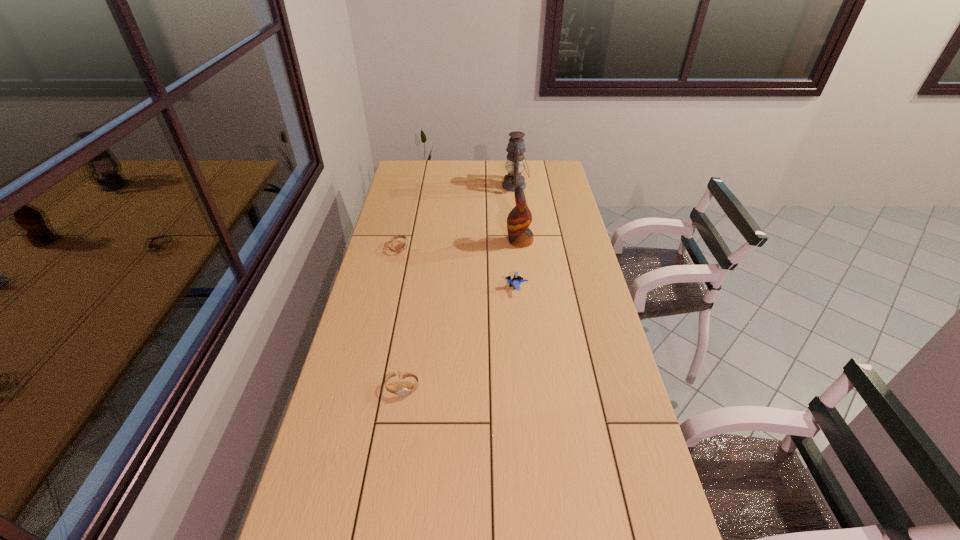
Identify which object is the third nearest to the fourth farthest object. Please provide its 2D coordinates. Your answer should be formatted as a tuple, i.e. [(x, y)], where the tuple contains the x and y coordinates of a point satisfying the conditions above.

[(402, 392)]

Identify which object is the third closest to the nearer watch. Please provide its 2D coordinates. Your answer should be formatted as a tuple, i.e. [(x, y)], where the tuple contains the x and y coordinates of a point satisfying the conditions above.

[(518, 221)]

Identify the location of vacant space that satisfies the following two spatial constraints: 1. on the front side of the farthest object; 2. on the face of the parrot. Image resolution: width=960 pixels, height=540 pixels. (522, 241).

This screenshot has height=540, width=960. What are the coordinates of `free location that satisfies the following two spatial constraints: 1. on the front-facing side of the Lego; 2. on the face of the nearer watch` in the screenshot? It's located at (525, 388).

Locate an element on the screen. vacant area in the image that satisfies the following two spatial constraints: 1. on the face of the parrot; 2. on the face of the second object from left to right is located at coordinates (537, 388).

Find the location of a particular element. vacant area in the image that satisfies the following two spatial constraints: 1. on the face of the parrot; 2. on the face of the fourth object from right to left is located at coordinates (537, 388).